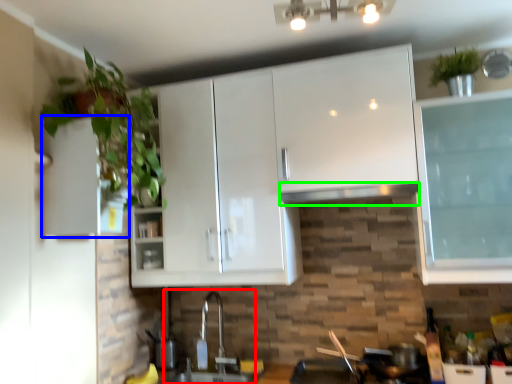
Question: Based on their relative distances, which object is nearer to sink (highlighted by a red box)? Choose from cabinetry (highlighted by a blue box) and exhaust hood (highlighted by a green box).

Choices:
 (A) cabinetry
 (B) exhaust hood

Answer: (B)